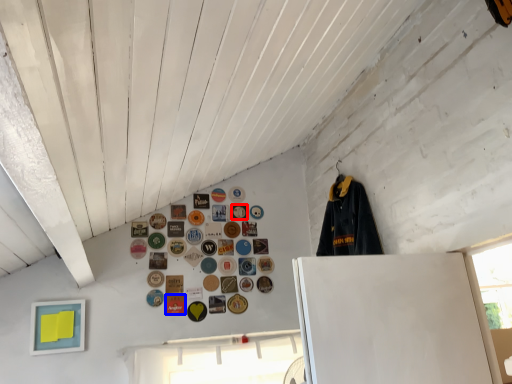
Question: Which point is closer to the camera, button (highlighted by a red box) or button (highlighted by a blue box)?

Choices:
 (A) button
 (B) button

Answer: (B)